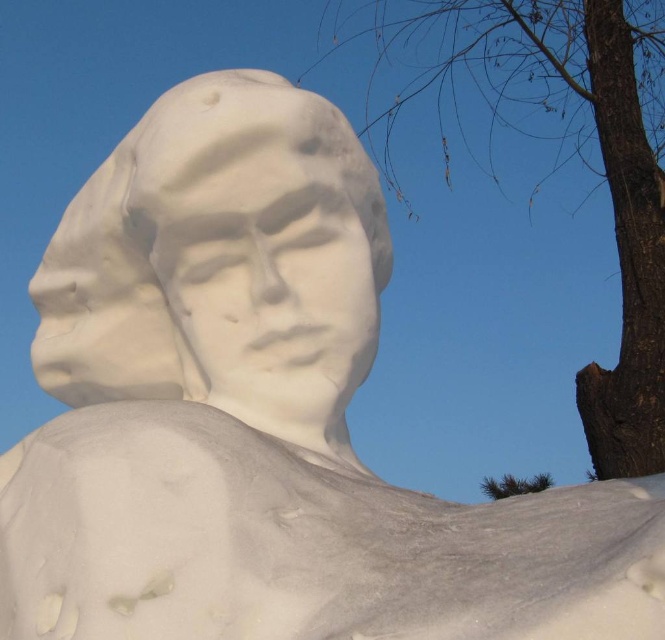
Who is positioned more to the left, white snow sculpture at center or brown rough bark at upper right?

Positioned to the left is white snow sculpture at center.

Does point (43, 296) come in front of point (384, 29)?

Yes.

What do you see at coordinates (219, 259) in the screenshot? This screenshot has height=640, width=665. I see `white snow sculpture at center` at bounding box center [219, 259].

The height and width of the screenshot is (640, 665). Find the location of `white snow sculpture at center`. white snow sculpture at center is located at coordinates (219, 259).